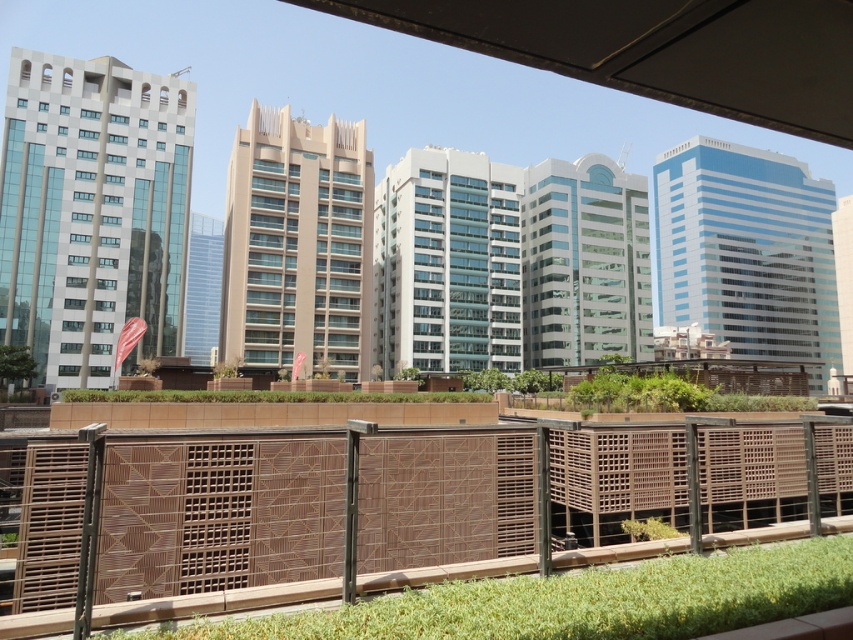
Who is taller, brown textured fence at lower center or green grass at lower center?

With more height is brown textured fence at lower center.

Between point (35, 573) and point (805, 572), which one is positioned behind?

Positioned behind is point (35, 573).

Image resolution: width=853 pixels, height=640 pixels. In order to click on brown textured fence at lower center in this screenshot , I will do `click(219, 513)`.